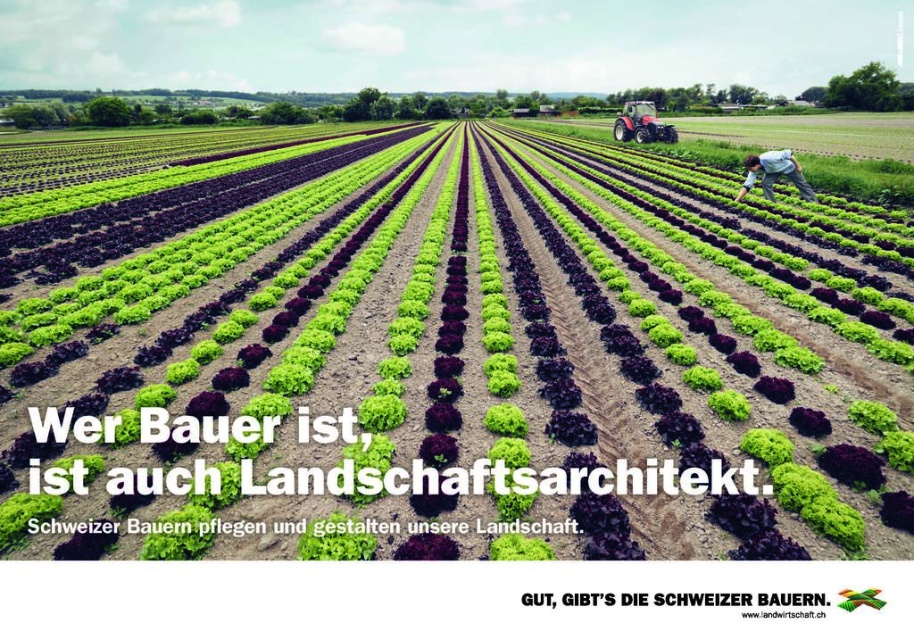
You are standing at the edge of a field and see the light blue denim jeans at lower right and the metallic silver tractor at upper center. You want to walk directly from the jeans to the tractor. How many steps would you need to take if each step covers about 3 feet?

The distance between the light blue denim jeans at lower right and the metallic silver tractor at upper center is 119.92 feet. Dividing this distance by 3 feet per step gives approximately 39.97 steps. Since you can only take whole steps, you would need to take 40 steps to reach the tractor.

Looking at this image, you are a farmer standing at the edge of the field. You see the green leafy vegetables at center and the metallic silver tractor at upper center. Which object is positioned higher in the image?

The metallic silver tractor at upper center is positioned higher in the image than the green leafy vegetables at center.